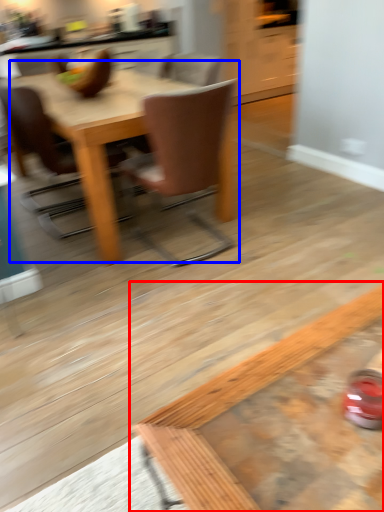
Question: Which point is closer to the camera, coffee table (highlighted by a red box) or kitchen & dining room table (highlighted by a blue box)?

Choices:
 (A) coffee table
 (B) kitchen & dining room table

Answer: (A)